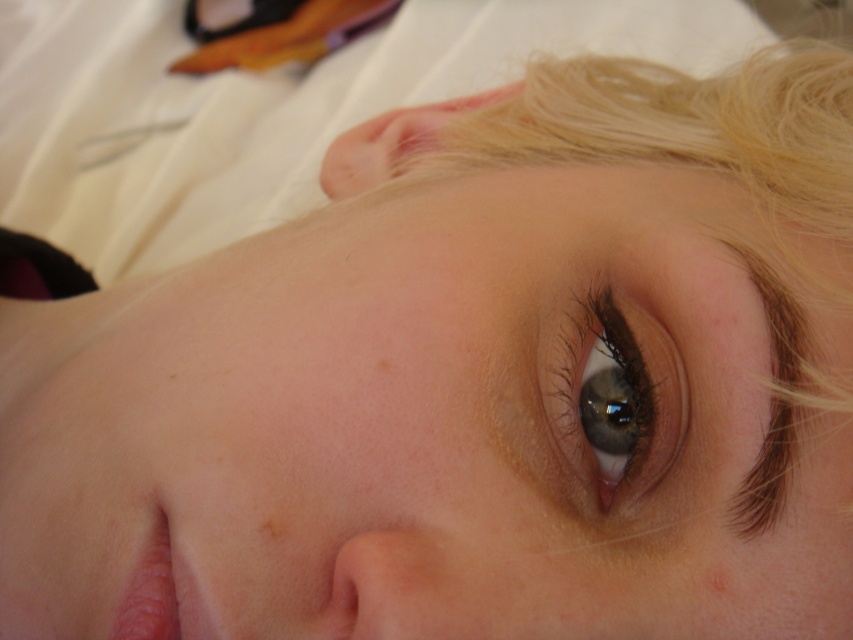
Question: Can you confirm if blonde hair at upper right is smaller than brown glossy eye at upper center?

Choices:
 (A) yes
 (B) no

Answer: (B)

Question: Does blonde hair at upper right have a smaller size compared to brown glossy eye at upper center?

Choices:
 (A) yes
 (B) no

Answer: (B)

Question: Which point appears farthest from the camera in this image?

Choices:
 (A) (639, 92)
 (B) (619, 477)

Answer: (A)

Question: Is blonde hair at upper right above brown glossy eye at upper center?

Choices:
 (A) no
 (B) yes

Answer: (B)